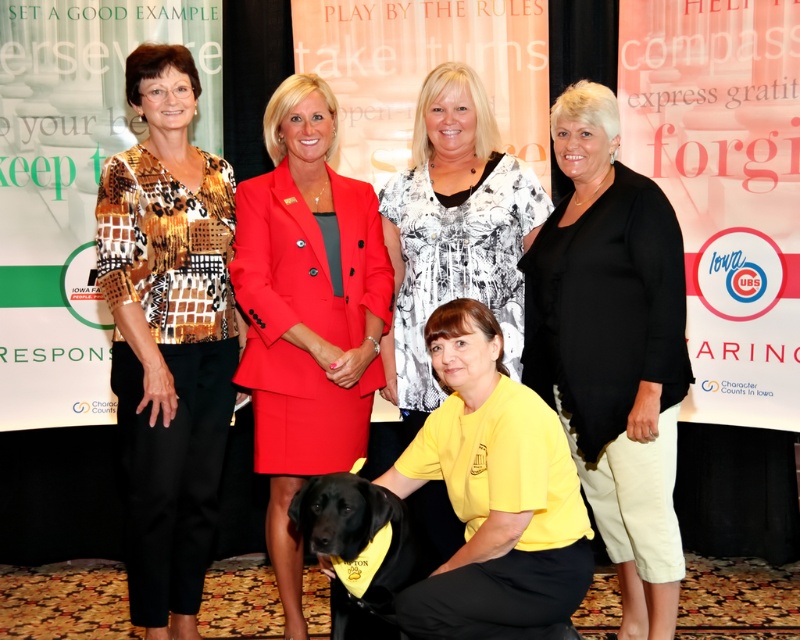
Question: Is matte red blazer at center above yellow matte shirt at lower center?

Choices:
 (A) yes
 (B) no

Answer: (A)

Question: Which point is farther to the camera?

Choices:
 (A) (152, 605)
 (B) (302, 472)
 (C) (576, 404)

Answer: (B)

Question: Which of the following is the farthest from the observer?

Choices:
 (A) yellow fabric shirt at center
 (B) yellow matte shirt at lower center
 (C) matte red blazer at center
 (D) shiny black lab at lower center

Answer: (A)

Question: Which of the following is the closest to the observer?

Choices:
 (A) (368, 317)
 (B) (466, 145)
 (C) (208, 266)

Answer: (C)

Question: Does matte red blazer at center lie in front of yellow fabric shirt at center?

Choices:
 (A) no
 (B) yes

Answer: (B)

Question: In this image, where is printed fabric blouse at left located relative to yellow fabric shirt at center?

Choices:
 (A) left
 (B) right

Answer: (A)